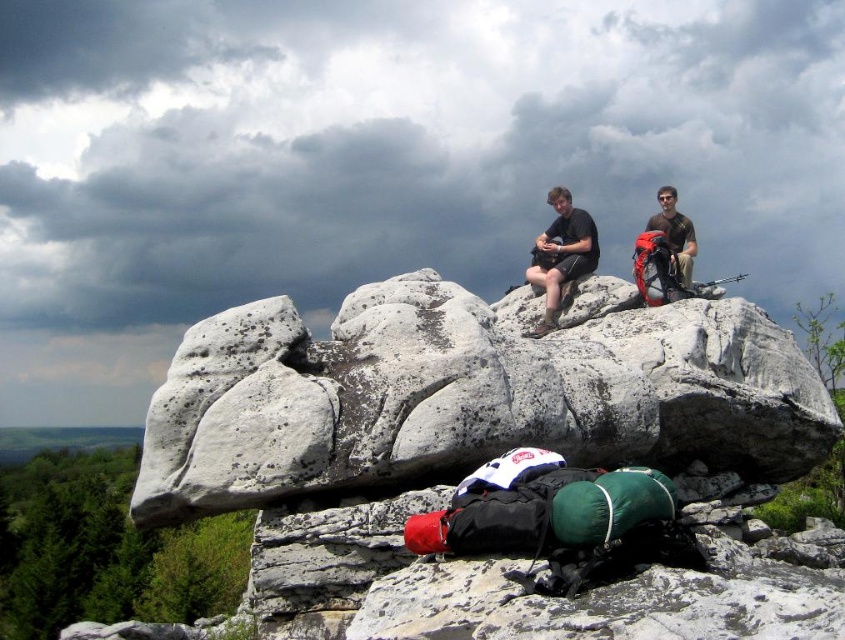
Is point (204, 394) farther from viewer compared to point (578, 218)?

No, it is in front of (578, 218).

Is point (669, 404) positioned behind point (590, 227)?

No, it is in front of (590, 227).

The width and height of the screenshot is (845, 640). What are the coordinates of `white rough rock at center` in the screenshot? It's located at (469, 394).

At what (x,y) coordinates should I click in order to perform the action: click on matte black shorts at center. Please return your answer as a coordinate pair (x, y). The image size is (845, 640). Looking at the image, I should click on (560, 253).

The width and height of the screenshot is (845, 640). In order to click on matte black shorts at center in this screenshot , I will do `click(560, 253)`.

Is point (597, 252) closer to camera compared to point (688, 262)?

That is True.

The width and height of the screenshot is (845, 640). What do you see at coordinates (560, 256) in the screenshot?
I see `matte black backpacks at center` at bounding box center [560, 256].

Identify the location of matte black backpacks at center. (560, 256).